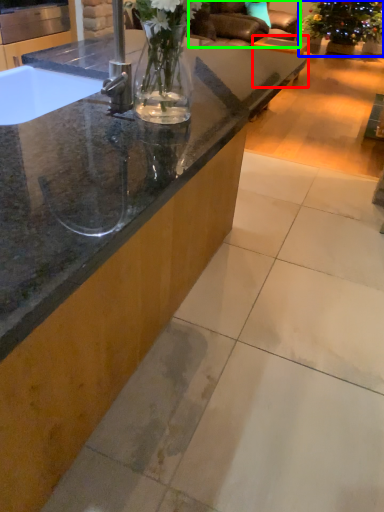
Question: Considering the real-world distances, which object is closest to table (highlighted by a red box)? houseplant (highlighted by a blue box) or armchair (highlighted by a green box).

Choices:
 (A) houseplant
 (B) armchair

Answer: (A)